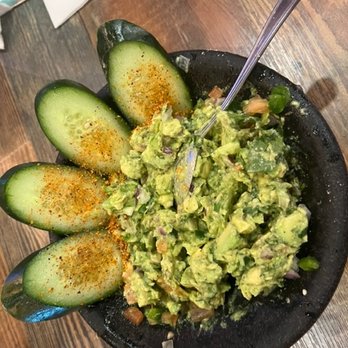
The width and height of the screenshot is (348, 348). I want to click on brown wooden part of table, so click(x=195, y=28).